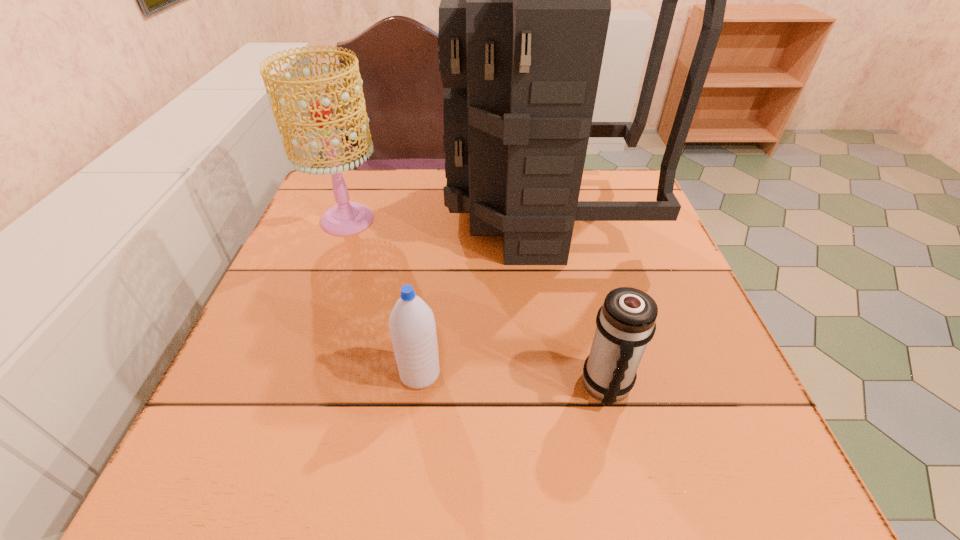
Identify the location of empty space that is in between the lampshade and the thermos bottle. (477, 303).

At what (x,y) coordinates should I click in order to perform the action: click on vacant area that lies between the backpack and the lampshade. Please return your answer as a coordinate pair (x, y). Looking at the image, I should click on (445, 217).

You are a GUI agent. You are given a task and a screenshot of the screen. Output one action in this format:
    pyautogui.click(x=<x>, y=<y>)
    Task: Click on the free space between the leftmost object and the tallest object
    Image resolution: width=960 pixels, height=540 pixels.
    Given the screenshot: What is the action you would take?
    pyautogui.click(x=445, y=217)

You are a GUI agent. You are given a task and a screenshot of the screen. Output one action in this format:
    pyautogui.click(x=<x>, y=<y>)
    Task: Click on the third closest object to the water bottle
    The width and height of the screenshot is (960, 540).
    Given the screenshot: What is the action you would take?
    pyautogui.click(x=346, y=218)

Point out which object is positioned as the nearest to the lampshade. Please provide its 2D coordinates. Your answer should be formatted as a tuple, i.e. [(x, y)], where the tuple contains the x and y coordinates of a point satisfying the conditions above.

[(525, 5)]

The height and width of the screenshot is (540, 960). What are the coordinates of `free space that satisfies the following two spatial constraints: 1. on the front side of the lampshade; 2. on the left side of the water bottle` in the screenshot? It's located at (291, 374).

Where is `vacant space that satisfies the following two spatial constraints: 1. on the front compartment of the backpack; 2. on the front side of the water bottle`? vacant space that satisfies the following two spatial constraints: 1. on the front compartment of the backpack; 2. on the front side of the water bottle is located at coordinates (x=572, y=374).

What are the coordinates of `free location that satisfies the following two spatial constraints: 1. on the front compartment of the tallest object; 2. on the front side of the water bottle` in the screenshot? It's located at (572, 374).